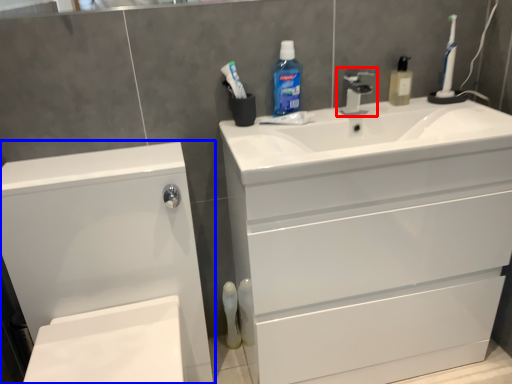
Question: Which of the following is the farthest to the observer, tap (highlighted by a red box) or bathroom cabinet (highlighted by a blue box)?

Choices:
 (A) tap
 (B) bathroom cabinet

Answer: (A)